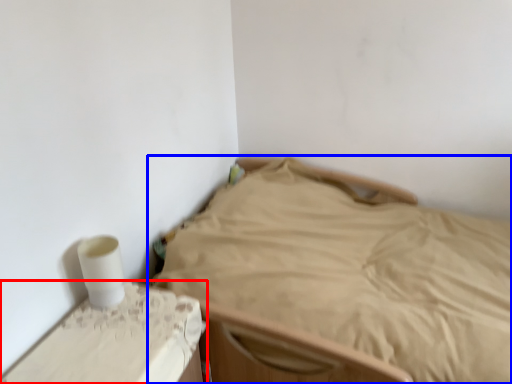
Question: Among these objects, which one is nearest to the camera, furniture (highlighted by a red box) or bed (highlighted by a blue box)?

Choices:
 (A) furniture
 (B) bed

Answer: (B)